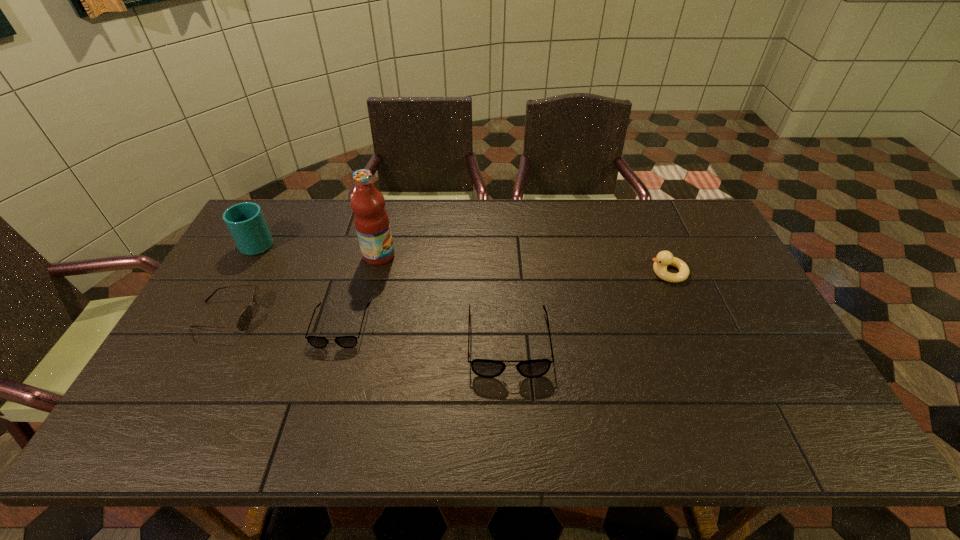
Locate an element on the screen. vacant space located 0.150m on the handle side of the second tallest object is located at coordinates (280, 202).

Locate an element on the screen. vacant space located at the beak of the rightmost object is located at coordinates (583, 272).

In order to click on vacant space situated at the beak of the rightmost object in this screenshot , I will do `click(546, 272)`.

Locate an element on the screen. The image size is (960, 540). free space located at the beak of the rightmost object is located at coordinates (560, 272).

You are a GUI agent. You are given a task and a screenshot of the screen. Output one action in this format:
    pyautogui.click(x=<x>, y=<y>)
    Task: Click on the free region located 0.240m on the front label of the fruit juice
    This screenshot has width=960, height=540.
    Given the screenshot: What is the action you would take?
    pyautogui.click(x=470, y=256)

This screenshot has height=540, width=960. I want to click on free space located 0.100m on the front-facing side of the sunglasses, so click(294, 315).

Where is `object that is at the far edge`? The height and width of the screenshot is (540, 960). object that is at the far edge is located at coordinates (245, 221).

The image size is (960, 540). Find the location of `object that is at the near edge`. object that is at the near edge is located at coordinates (486, 368).

Find the location of a particular element. Image resolution: width=960 pixels, height=540 pixels. cup that is at the left edge is located at coordinates (245, 221).

At what (x,y) coordinates should I click in order to perform the action: click on sunglasses that is at the left edge. Please return your answer as a coordinate pair (x, y). Looking at the image, I should click on (243, 322).